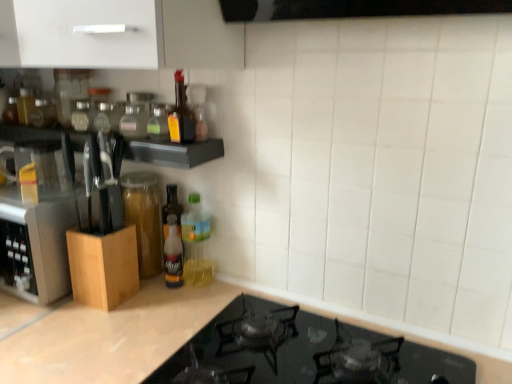
Question: Is point 144,264 closer or farther from the camera than point 142,92?

Choices:
 (A) farther
 (B) closer

Answer: (A)

Question: Relative to clear glass bottle at upper center, which is the 6th bottle from bottom to top, is transparent glass jar at left in front or behind?

Choices:
 (A) front
 (B) behind

Answer: (B)

Question: Which object is the closest to the translucent plastic bottle at center, the second bottle in the bottom-to-top sequence?

Choices:
 (A) translucent glass bottle at upper center, marked as the 4th bottle in a top-to-bottom arrangement
 (B) matte glass bottle at upper center, the 5th bottle ordered from the bottom
 (C) translucent plastic bottle at upper center, the third bottle when ordered from top to bottom
 (D) translucent glass bottle at center, the first bottle positioned from the bottom
 (E) transparent glass jar at left

Answer: (D)

Question: Estimate the real-world distances between objects in this image. Which object is closer to the matte glass bottle at upper center, the second bottle viewed from the top?

Choices:
 (A) clear glass bottle at upper center, the first bottle from the top
 (B) translucent glass bottle at center, which is the sixth bottle in top-to-bottom order
 (C) translucent plastic bottle at center, marked as the 5th bottle in a top-to-bottom arrangement
 (D) black glass stovetop at lower center
 (E) transparent glass jar at left

Answer: (A)